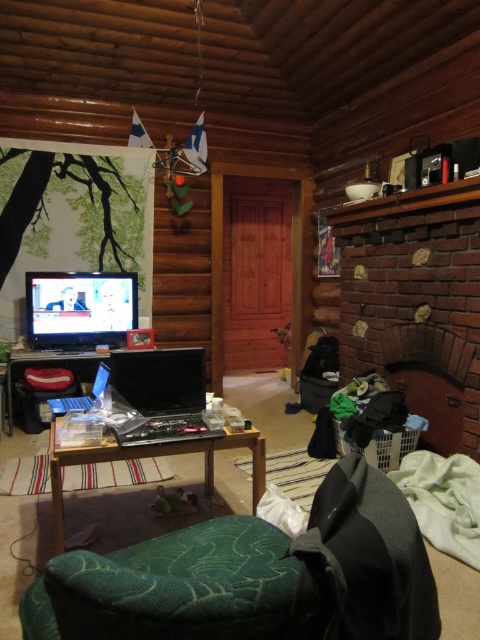
Question: From the image, what is the correct spatial relationship of green fabric armchair at lower center in relation to shiny silver laptop at lower left?

Choices:
 (A) right
 (B) left

Answer: (A)

Question: Which point is closer to the camera taking this photo?

Choices:
 (A) (403, 280)
 (B) (213, 468)
 (C) (189, 416)
 (D) (106, 364)

Answer: (C)

Question: Which point is closer to the camera?

Choices:
 (A) satin black laptop at center
 (B) green fabric armchair at lower center
 (C) brick fireplace at upper right
 (D) shiny silver laptop at lower left

Answer: (B)

Question: Which point is closer to the camera taking this photo?

Choices:
 (A) (394, 221)
 (B) (343, 620)

Answer: (B)

Question: Considering the relative positions of brick fireplace at upper right and shiny silver laptop at lower left in the image provided, where is brick fireplace at upper right located with respect to shiny silver laptop at lower left?

Choices:
 (A) left
 (B) right

Answer: (B)

Question: Is satin black laptop at center bigger than shiny silver laptop at lower left?

Choices:
 (A) no
 (B) yes

Answer: (B)